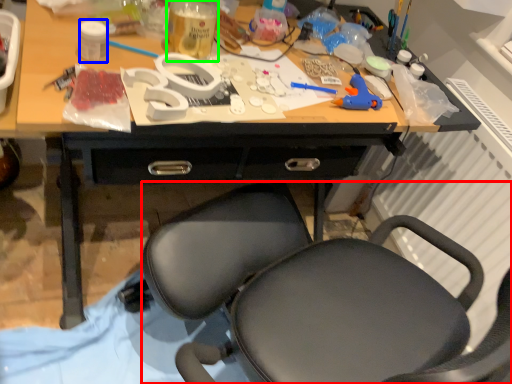
Question: Based on their relative distances, which object is farther from chair (highlighted by a red box)? Choose from bottle (highlighted by a blue box) and bottle (highlighted by a green box).

Choices:
 (A) bottle
 (B) bottle

Answer: (A)